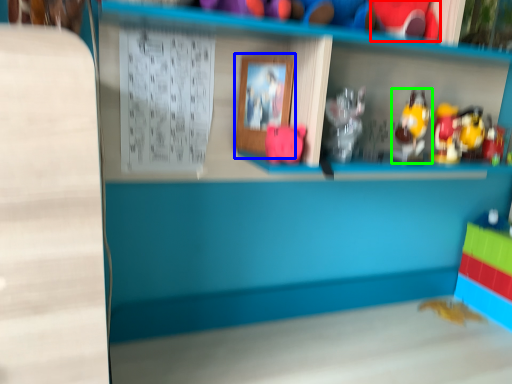
Question: Which object is the closest to the toy (highlighted by a red box)? Choose among these: picture frame (highlighted by a blue box) or toy (highlighted by a green box).

Choices:
 (A) picture frame
 (B) toy

Answer: (B)